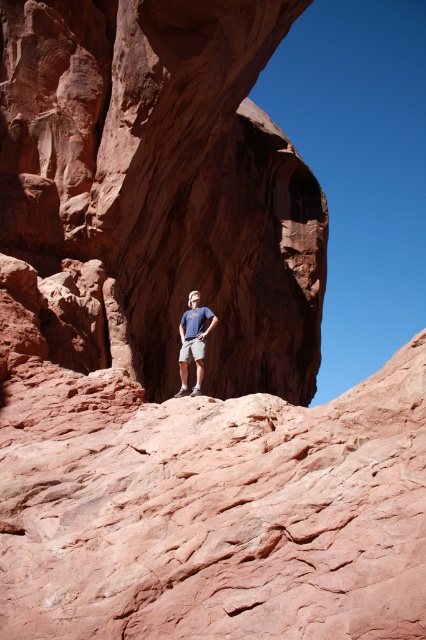
Question: Which object appears closest to the camera in this image?

Choices:
 (A) reddish-brown sandstone arch at center
 (B) matte blue t-shirt at center

Answer: (B)

Question: Observing the image, what is the correct spatial positioning of reddish-brown sandstone arch at center in reference to matte blue t-shirt at center?

Choices:
 (A) left
 (B) right

Answer: (B)

Question: Which point is closer to the camera?

Choices:
 (A) (293, 273)
 (B) (180, 330)

Answer: (B)

Question: Is reddish-brown sandstone arch at center bigger than matte blue t-shirt at center?

Choices:
 (A) yes
 (B) no

Answer: (A)

Question: Considering the relative positions of reddish-brown sandstone arch at center and matte blue t-shirt at center in the image provided, where is reddish-brown sandstone arch at center located with respect to matte blue t-shirt at center?

Choices:
 (A) below
 (B) above

Answer: (B)